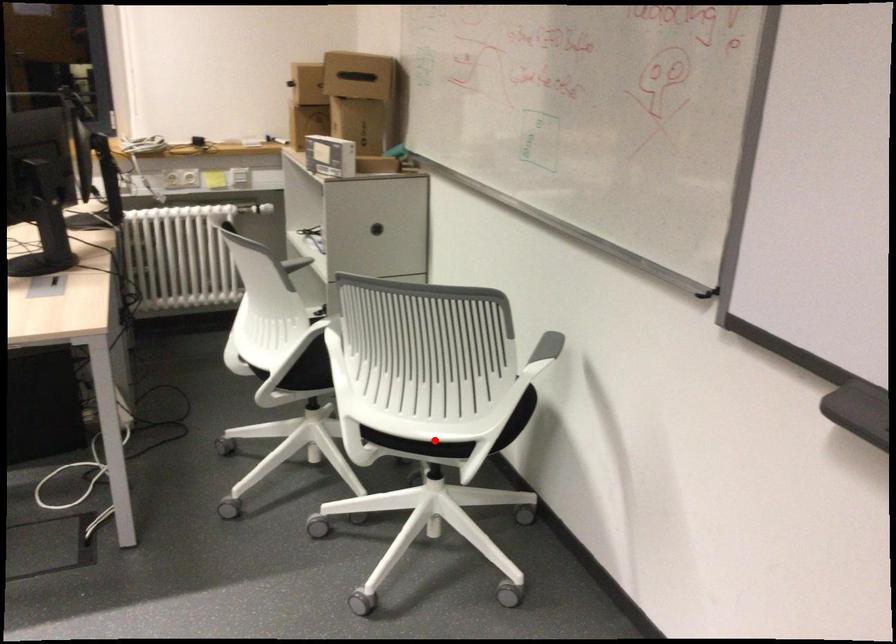
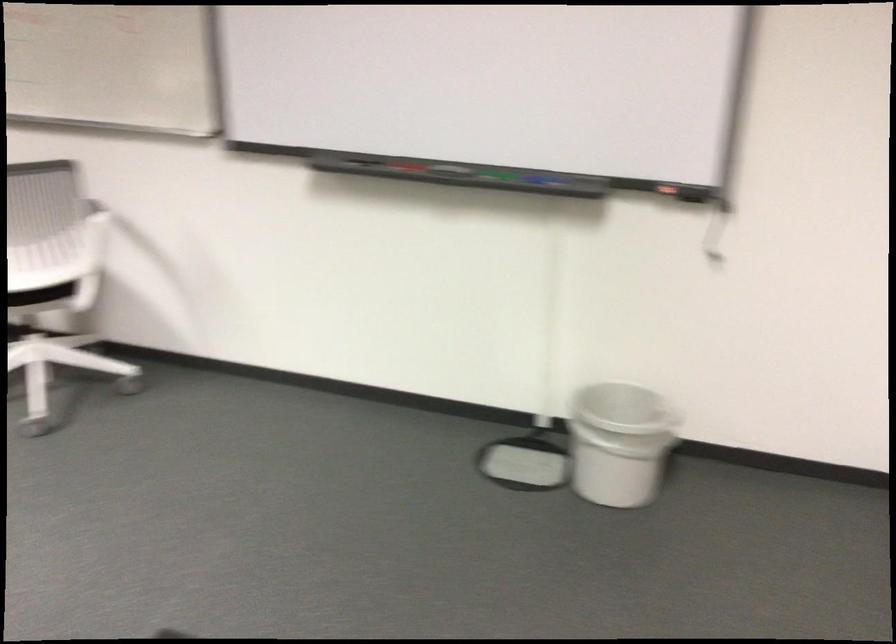
Question: I am providing you with two images of the same scene from different viewpoints. In image1, a red point is highlighted. Considering the same 3D point in image2, which of the following is correct?

Choices:
 (A) It is closer
 (B) It is farther

Answer: (B)